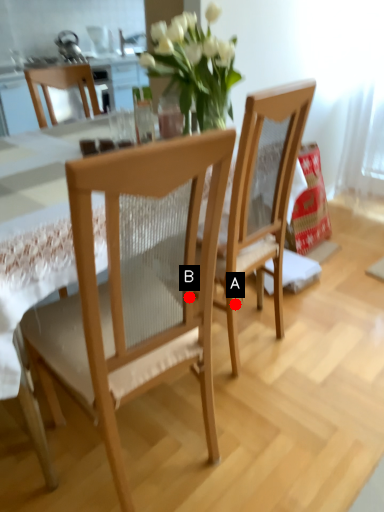
Question: Two points are circled on the image, labeled by A and B beside each circle. Which point is closer to the camera?

Choices:
 (A) A is closer
 (B) B is closer

Answer: (B)